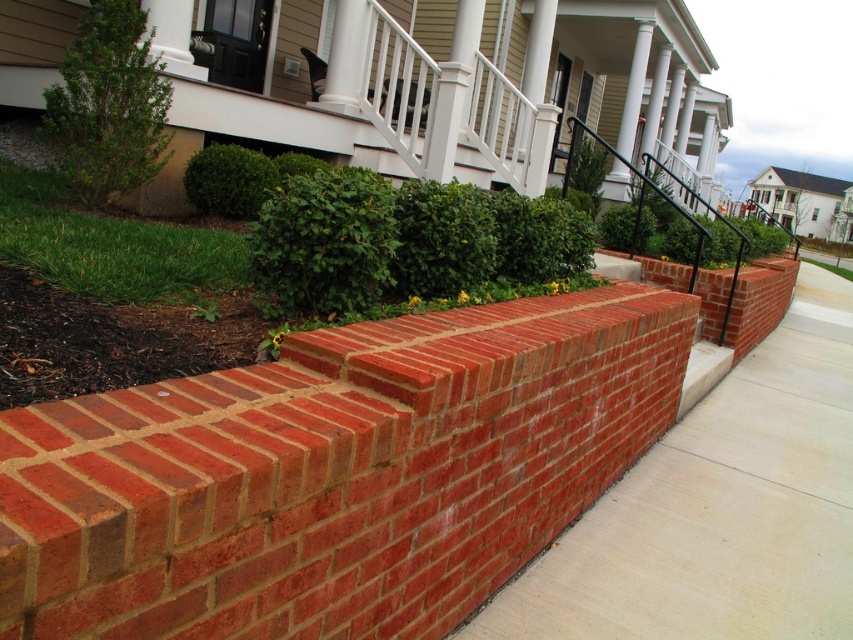
You are a delivery person trying to navigate a narrow path between the red brick pavement at center and the green leafy bush at upper left. The path is only as wide as the narrower of the two. Can you pass through if your delivery cart is 1.2 meters wide?

The red brick pavement at center is wider than the green leafy bush at upper left. Since the path is as wide as the narrower object, which is the green leafy bush at upper left, and its width is not specified, but since the cart is 1.2 meters wide, we cannot determine if it will fit without knowing the exact width of the bush.

You are standing on the sidewalk in front of the brick wall and notice both the green leafy hedge at center and the green leafy bush at upper left. Which of these plants is closer to you?

The green leafy hedge at center is closer to you because it is positioned in front of the green leafy bush at upper left.

You are a gardener standing on the sidewalk and want to water both the red brick wall at center and the green leafy hedge at center. Which one is closer to your left side?

The green leafy hedge at center is closer to your left side because the red brick wall at center is to the right of it.